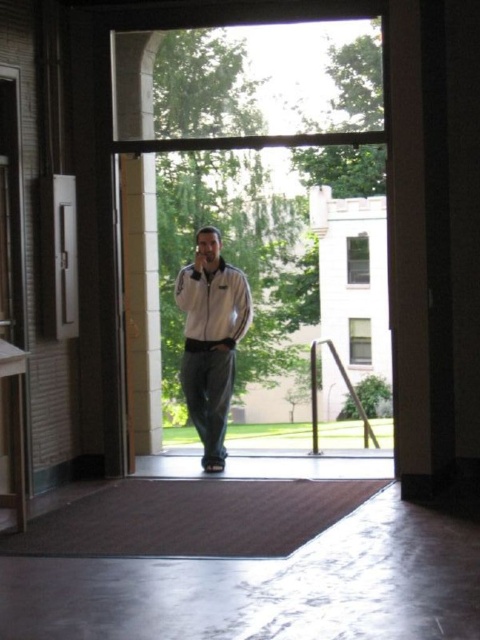
Can you confirm if transparent glass door at center is smaller than white matte jacket at center?

No, transparent glass door at center is not smaller than white matte jacket at center.

Where is `transparent glass door at center`? The image size is (480, 640). transparent glass door at center is located at coordinates (255, 211).

The image size is (480, 640). I want to click on transparent glass door at center, so click(255, 211).

Does transparent glass door at center appear on the right side of metallic silver door at left?

Correct, you'll find transparent glass door at center to the right of metallic silver door at left.

Which is below, transparent glass door at center or metallic silver door at left?

metallic silver door at left

Does point (264, 346) lie in front of point (54, 227)?

No, it is not.

Locate an element on the screen. This screenshot has height=640, width=480. transparent glass door at center is located at coordinates (255, 211).

Between white matte jacket at center and metallic silver door at left, which one appears on the right side from the viewer's perspective?

Positioned to the right is white matte jacket at center.

What do you see at coordinates (211, 339) in the screenshot? I see `white matte jacket at center` at bounding box center [211, 339].

The width and height of the screenshot is (480, 640). What do you see at coordinates (211, 339) in the screenshot? I see `white matte jacket at center` at bounding box center [211, 339].

Find the location of a particular element. This screenshot has width=480, height=640. white matte jacket at center is located at coordinates (211, 339).